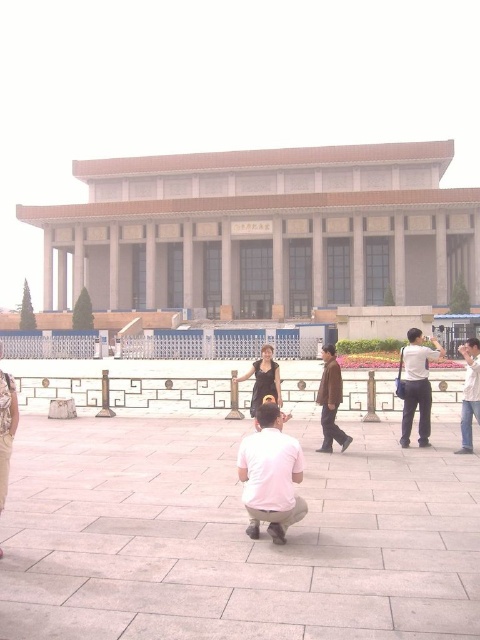
Question: Is light gray pants at right positioned at the back of brown leather jacket at center?

Choices:
 (A) no
 (B) yes

Answer: (B)

Question: Which is farther from the light gray pants at right?

Choices:
 (A) white matte shirt at center
 (B) white cotton shirt at right

Answer: (A)

Question: Which is nearer to the light gray pants at right?

Choices:
 (A) brown leather jacket at center
 (B) white cotton shirt at right

Answer: (B)

Question: Which of the following is the closest to the observer?

Choices:
 (A) (469, 352)
 (B) (334, 371)
 (C) (251, 522)
 (D) (423, 353)

Answer: (C)

Question: Can you confirm if light gray pants at right is positioned to the right of white cotton shirt at right?

Choices:
 (A) yes
 (B) no

Answer: (B)

Question: Is white matte shirt at center positioned in front of white cotton shirt at right?

Choices:
 (A) no
 (B) yes

Answer: (B)